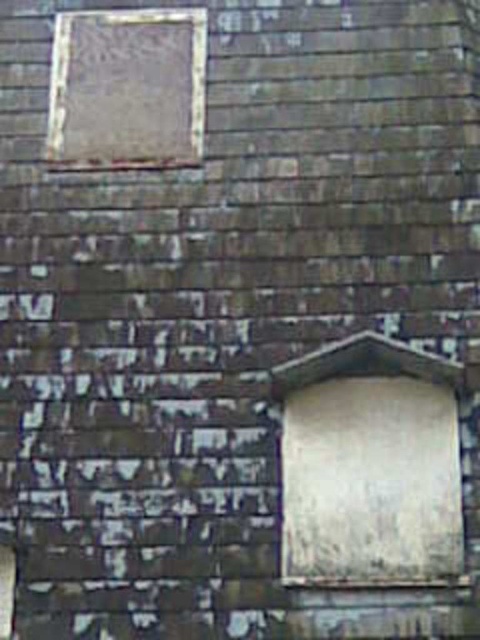
You are standing in front of a historical stone wall. You see a white matte window at lower right and a matte glass window at upper left. Which window is positioned higher up on the wall?

The matte glass window at upper left is positioned higher up on the wall than the white matte window at lower right.

You are standing in front of a historical stone wall with a plaque on the upper left. You notice a point marked at coordinates (370, 465). What object is located at this point?

The point at coordinates (370, 465) indicates the location of the white matte window at lower right.